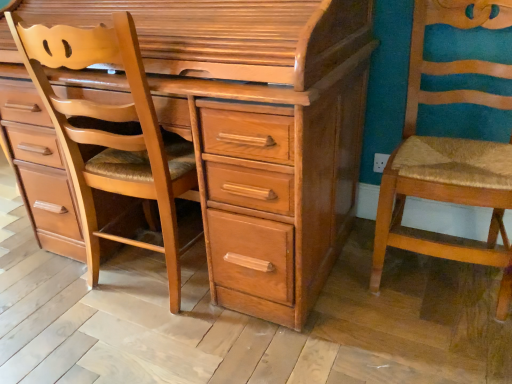
Question: Could you tell me if light brown wood chair at left is turned towards light brown wood chest of drawers at center?

Choices:
 (A) yes
 (B) no

Answer: (A)

Question: From a real-world perspective, is light brown wood chair at left on light brown wood chest of drawers at center?

Choices:
 (A) yes
 (B) no

Answer: (B)

Question: Is light brown wood chair at left not near light brown wood chest of drawers at center?

Choices:
 (A) yes
 (B) no

Answer: (B)

Question: Considering the relative sizes of light brown wood chair at left and light brown wood chest of drawers at center in the image provided, is light brown wood chair at left taller than light brown wood chest of drawers at center?

Choices:
 (A) yes
 (B) no

Answer: (B)

Question: Does light brown wood chair at left appear on the left side of light brown wood chest of drawers at center?

Choices:
 (A) no
 (B) yes

Answer: (B)

Question: Based on their positions, is light brown wood chair at left located to the left or right of light brown wood chest of drawers at center?

Choices:
 (A) left
 (B) right

Answer: (A)

Question: Looking at their shapes, would you say light brown wood chair at left is wider or thinner than light brown wood chest of drawers at center?

Choices:
 (A) thin
 (B) wide

Answer: (A)

Question: From their relative heights in the image, would you say light brown wood chair at left is taller or shorter than light brown wood chest of drawers at center?

Choices:
 (A) tall
 (B) short

Answer: (B)

Question: Is light brown wood chair at left in front of or behind light brown wood chest of drawers at center in the image?

Choices:
 (A) front
 (B) behind

Answer: (B)

Question: Considering the positions of light brown wood chest of drawers at center and wooden textured chair at right in the image, is light brown wood chest of drawers at center taller or shorter than wooden textured chair at right?

Choices:
 (A) tall
 (B) short

Answer: (A)

Question: In terms of width, does light brown wood chest of drawers at center look wider or thinner when compared to wooden textured chair at right?

Choices:
 (A) thin
 (B) wide

Answer: (B)

Question: Based on their sizes in the image, would you say light brown wood chest of drawers at center is bigger or smaller than wooden textured chair at right?

Choices:
 (A) small
 (B) big

Answer: (B)

Question: Visually, is light brown wood chest of drawers at center positioned to the left or to the right of wooden textured chair at right?

Choices:
 (A) right
 (B) left

Answer: (B)

Question: From a real-world perspective, is light brown wood chair at left positioned above or below wooden textured chair at right?

Choices:
 (A) below
 (B) above

Answer: (B)

Question: Is light brown wood chair at left in front of or behind wooden textured chair at right in the image?

Choices:
 (A) front
 (B) behind

Answer: (B)